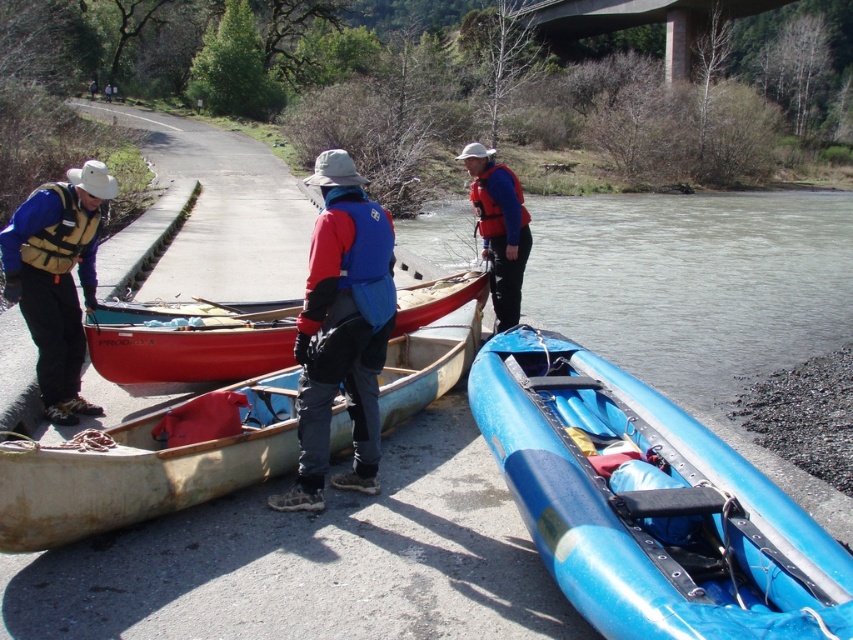
Question: Based on their relative distances, which object is farther from the matte blue life vest at center?

Choices:
 (A) matte red canoe at center
 (B) matte yellow life jacket at left
 (C) blue rubber boat at lower right
 (D) red fabric jacket at center

Answer: (B)

Question: Is matte red canoe at center to the left of matte yellow life vest at left from the viewer's perspective?

Choices:
 (A) no
 (B) yes

Answer: (A)

Question: Is red fabric jacket at center thinner than matte blue life vest at center?

Choices:
 (A) yes
 (B) no

Answer: (A)

Question: Which point appears closest to the camera in this image?

Choices:
 (A) (479, 417)
 (B) (247, 451)

Answer: (B)

Question: Which of these objects is positioned farthest from the blue rubber boat at lower right?

Choices:
 (A) wooden canoe at center
 (B) matte blue life jacket at center
 (C) matte red canoe at center

Answer: (B)

Question: Can you confirm if blue rubber boat at lower right is wider than matte yellow life vest at left?

Choices:
 (A) no
 (B) yes

Answer: (B)